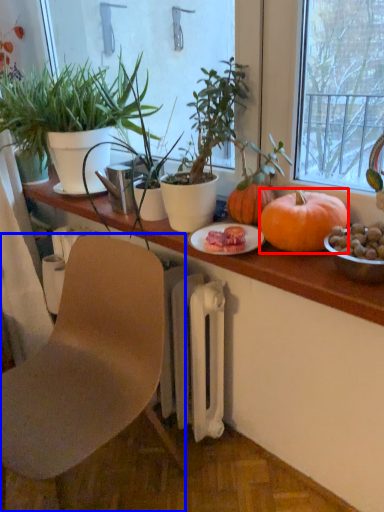
Question: Among these objects, which one is farthest to the camera, pumpkin (highlighted by a red box) or chair (highlighted by a blue box)?

Choices:
 (A) pumpkin
 (B) chair

Answer: (A)